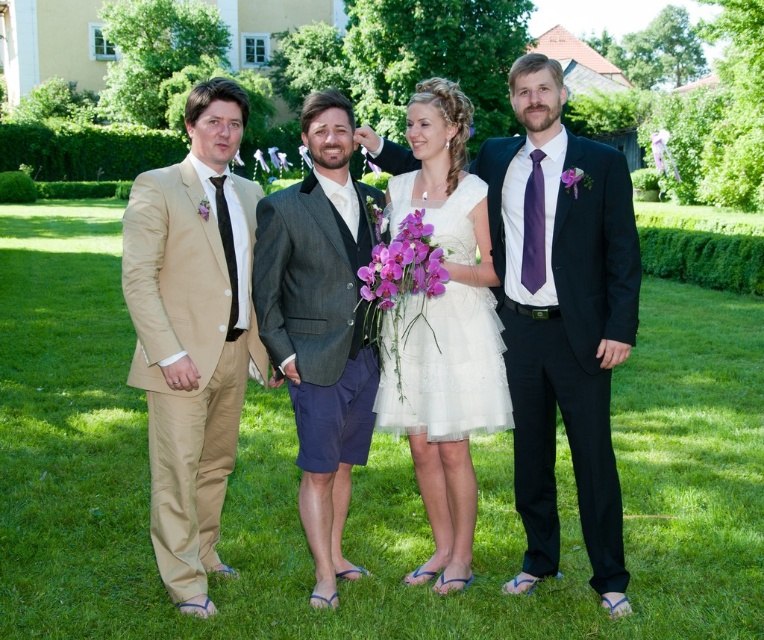
Question: Is matte black suit at right to the right of white tulle dress at center from the viewer's perspective?

Choices:
 (A) no
 (B) yes

Answer: (B)

Question: Which point is farther to the camera?

Choices:
 (A) white lace dress at center
 (B) beige satin suit at left
 (C) white tulle dress at center

Answer: (C)

Question: Among these points, which one is farthest from the camera?

Choices:
 (A) (309, 333)
 (B) (435, 320)

Answer: (B)

Question: Which is nearer to the white lace dress at center?

Choices:
 (A) beige satin suit at left
 (B) matte black suit at right
 (C) gray textured blazer at center
 (D) white tulle dress at center

Answer: (D)

Question: Is green grass at center to the left of beige satin suit at left from the viewer's perspective?

Choices:
 (A) no
 (B) yes

Answer: (A)

Question: In this image, where is gray textured blazer at center located relative to white lace dress at center?

Choices:
 (A) right
 (B) left

Answer: (B)